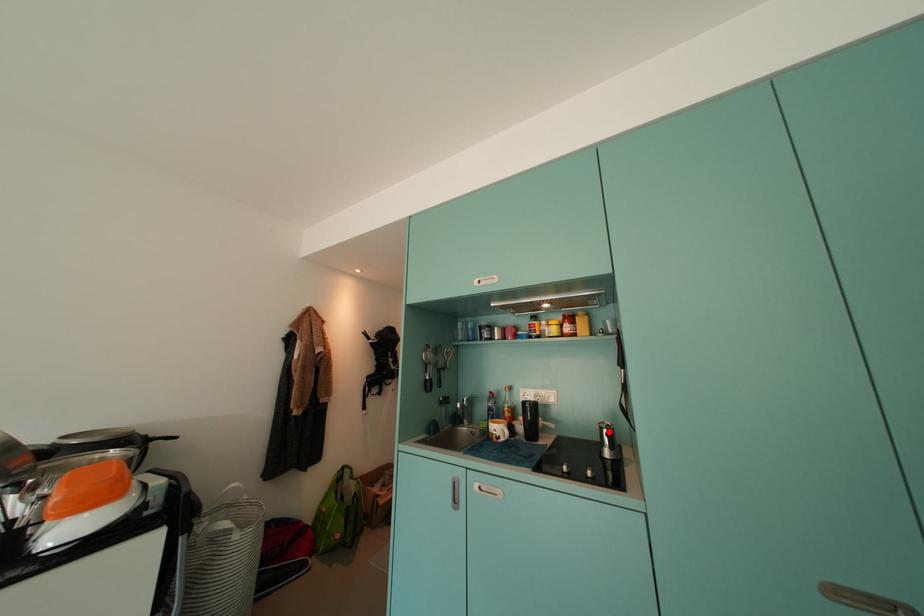
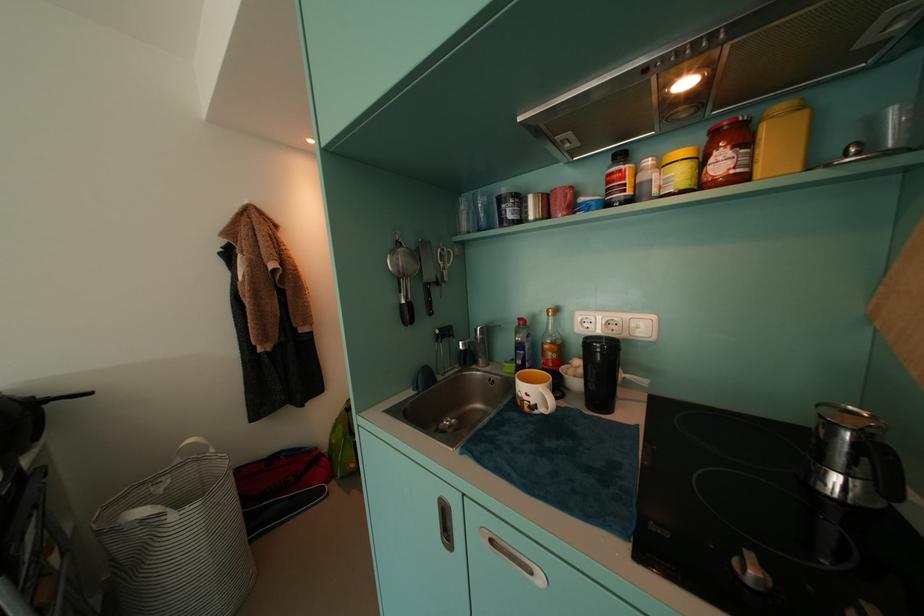
In the second image, find the point that corresponds to the highlighted location in the first image.

(837, 429)